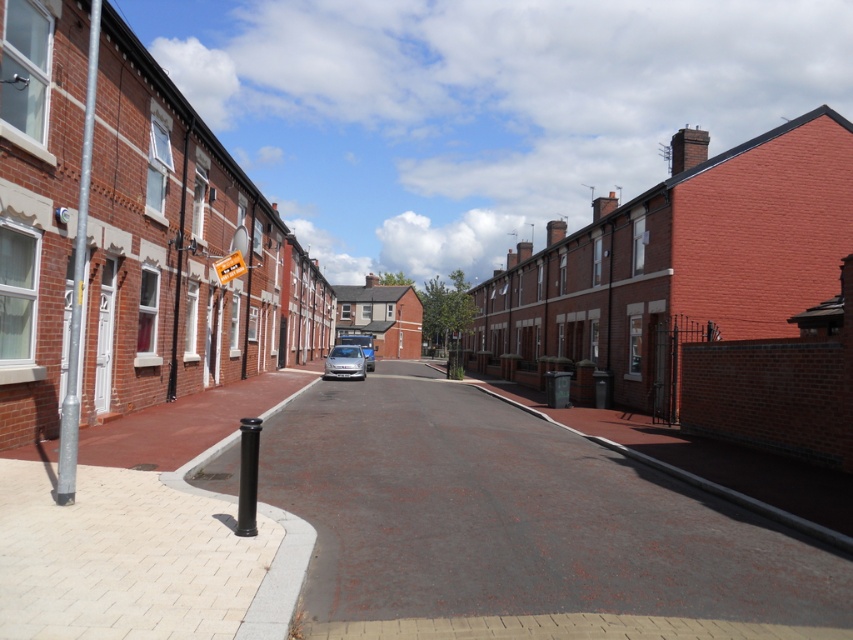
Question: Does smooth asphalt road at center have a lesser width compared to satin silver car at center?

Choices:
 (A) no
 (B) yes

Answer: (A)

Question: Among these objects, which one is farthest from the camera?

Choices:
 (A) satin silver car at center
 (B) smooth asphalt road at center
 (C) yellow plastic street sign at center

Answer: (A)

Question: Which point is closer to the camera?

Choices:
 (A) smooth asphalt road at center
 (B) satin silver car at center
 (C) yellow plastic street sign at center

Answer: (A)

Question: Which object is farther from the camera taking this photo?

Choices:
 (A) satin silver car at center
 (B) yellow plastic street sign at center
 (C) smooth asphalt road at center

Answer: (A)

Question: Can you confirm if smooth asphalt road at center is positioned to the right of satin silver car at center?

Choices:
 (A) no
 (B) yes

Answer: (B)

Question: Is smooth asphalt road at center further to the viewer compared to yellow plastic street sign at center?

Choices:
 (A) no
 (B) yes

Answer: (A)